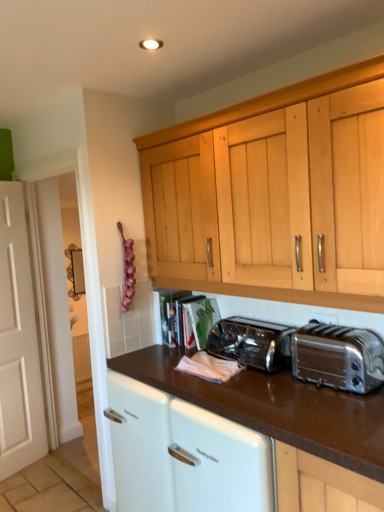
Question: Considering the positions of silver metallic toaster at right, the second toaster positioned from the back, and satin silver toaster at center, which is the 1th toaster from back to front, in the image, is silver metallic toaster at right, the second toaster positioned from the back, taller or shorter than satin silver toaster at center, which is the 1th toaster from back to front,?

Choices:
 (A) tall
 (B) short

Answer: (A)

Question: From the image's perspective, is silver metallic toaster at right, the second toaster positioned from the back, positioned above or below satin silver toaster at center, marked as the second toaster in a front-to-back arrangement?

Choices:
 (A) below
 (B) above

Answer: (B)

Question: Which is farther from the brown glossy countertop at center?

Choices:
 (A) silver metallic toaster at right, which is the first toaster in front-to-back order
 (B) satin silver toaster at center, marked as the second toaster in a front-to-back arrangement

Answer: (B)

Question: Estimate the real-world distances between objects in this image. Which object is farther from the brown glossy countertop at center?

Choices:
 (A) satin silver toaster at center, marked as the second toaster in a front-to-back arrangement
 (B) silver metallic toaster at right, which is the first toaster in front-to-back order

Answer: (A)